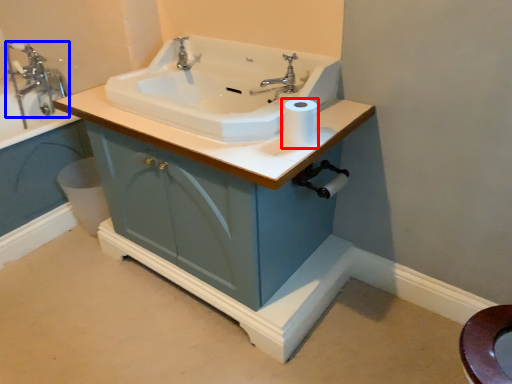
Question: Which of the following is the closest to the observer, toilet paper (highlighted by a red box) or tap (highlighted by a blue box)?

Choices:
 (A) toilet paper
 (B) tap

Answer: (A)